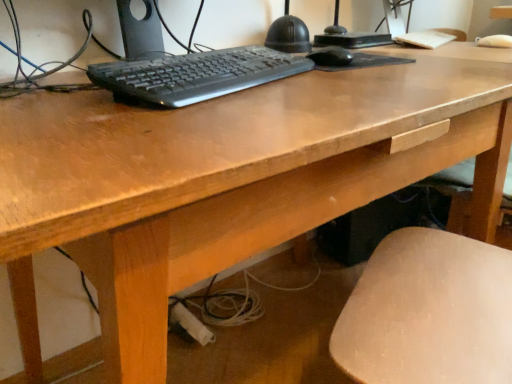
Question: Is black plastic keyboard at center spatially inside black matte mouse at center, or outside of it?

Choices:
 (A) inside
 (B) outside

Answer: (B)

Question: From the image's perspective, is black plastic keyboard at center above or below black matte mouse at center?

Choices:
 (A) below
 (B) above

Answer: (A)

Question: Considering their positions, is black plastic keyboard at center located in front of or behind black matte mouse at center?

Choices:
 (A) front
 (B) behind

Answer: (A)

Question: Considering the relative positions of black matte mouse at center and black plastic keyboard at center in the image provided, is black matte mouse at center to the left or to the right of black plastic keyboard at center?

Choices:
 (A) right
 (B) left

Answer: (A)

Question: Is black matte mouse at center spatially inside black plastic keyboard at center, or outside of it?

Choices:
 (A) outside
 (B) inside

Answer: (A)

Question: Is point (324, 54) positioned closer to the camera than point (261, 56)?

Choices:
 (A) farther
 (B) closer

Answer: (A)

Question: In terms of size, does black matte mouse at center appear bigger or smaller than black plastic keyboard at center?

Choices:
 (A) small
 (B) big

Answer: (A)